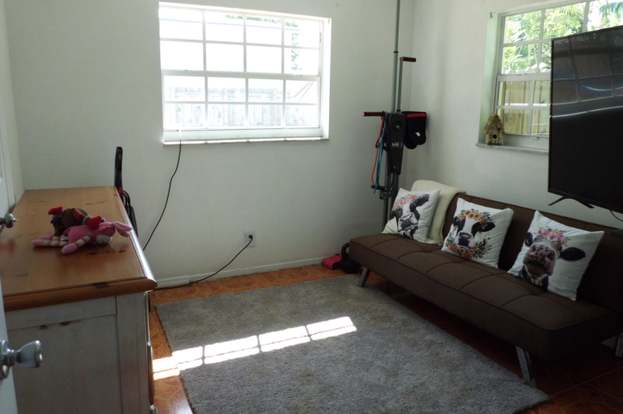
Identify the location of tv screen. (586, 126).